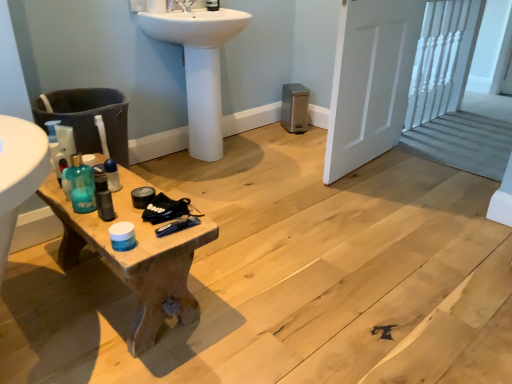
The width and height of the screenshot is (512, 384). Identify the location of free spot to the right of white glossy sink at upper center. (280, 156).